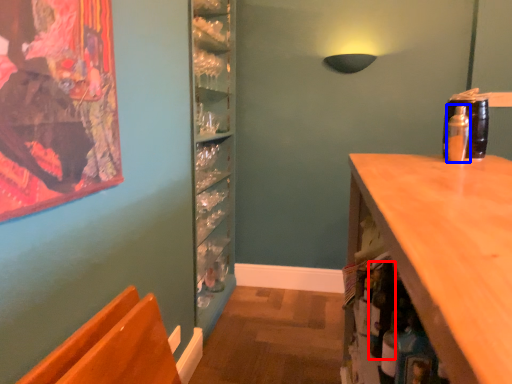
Question: Which of the following is the closest to the observer, bottle (highlighted by a red box) or bottle (highlighted by a blue box)?

Choices:
 (A) bottle
 (B) bottle

Answer: (A)